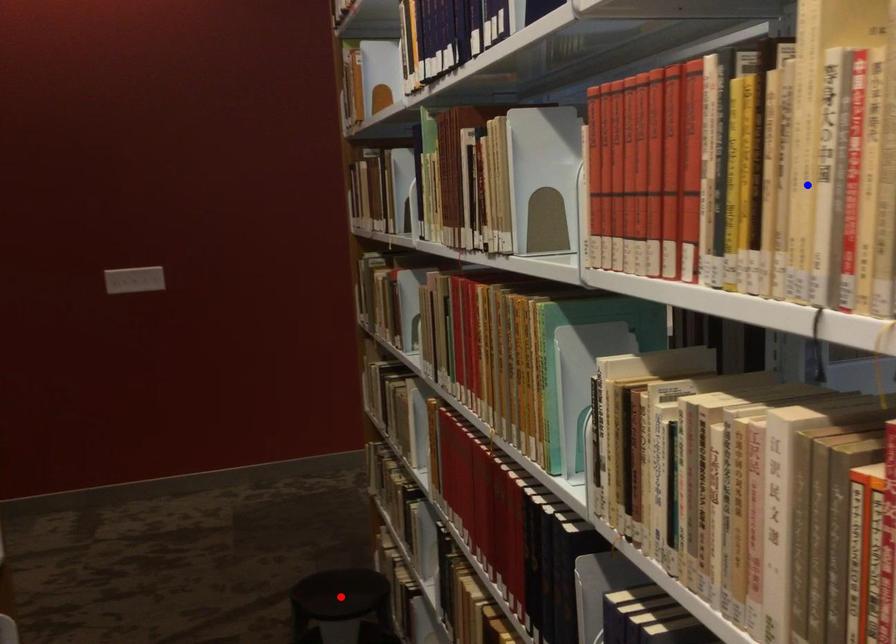
Question: Two points are marked on the image. Which point is closer to the camera?

Choices:
 (A) Blue point is closer.
 (B) Red point is closer.

Answer: (A)